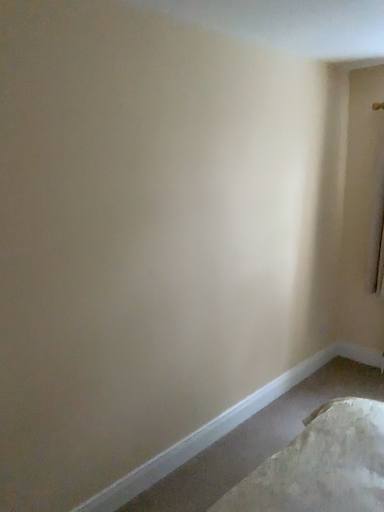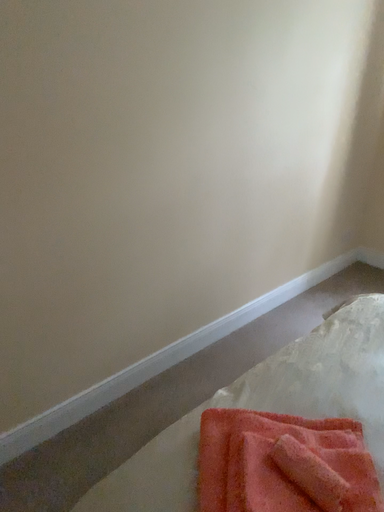
Question: Which way did the camera rotate in the video?

Choices:
 (A) rotated downward
 (B) rotated upward

Answer: (A)